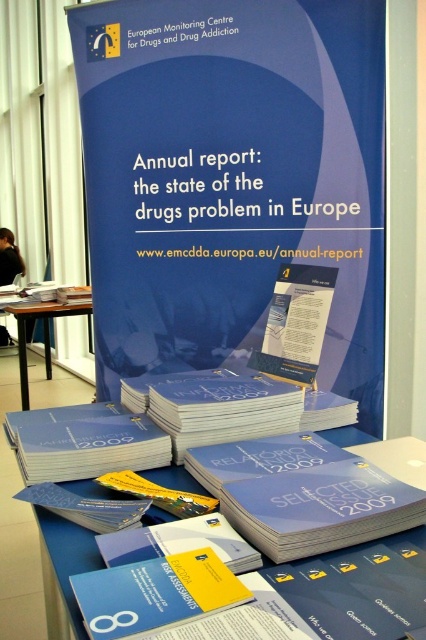
Question: Is blue paper brochures at center above wooden table at lower left?

Choices:
 (A) no
 (B) yes

Answer: (A)

Question: Which point is farther to the camera?

Choices:
 (A) coord(143,573)
 (B) coord(189,77)
 (C) coord(92,312)
 (D) coord(281,474)

Answer: (C)

Question: Which of the following is the closest to the observer?

Choices:
 (A) blue paper book at center
 (B) wooden table at lower left
 (C) blue paper brochures at center

Answer: (A)

Question: Is blue paper at center behind blue paper brochures at center?

Choices:
 (A) yes
 (B) no

Answer: (A)

Question: Can you confirm if blue paper at center is positioned to the left of blue paper book at center?

Choices:
 (A) no
 (B) yes

Answer: (A)

Question: Which object is closer to the camera taking this photo?

Choices:
 (A) blue paper brochures at center
 (B) blue paper booklet at center
 (C) wooden table at lower left

Answer: (B)